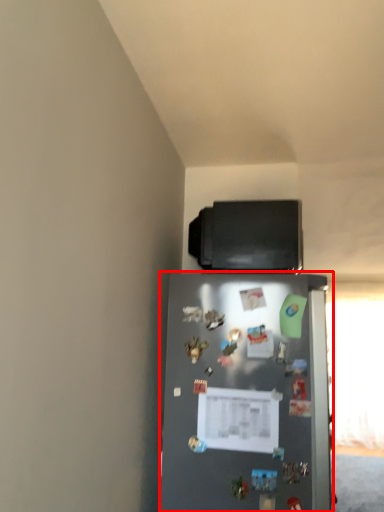
Question: In this image, where is refrigerator (annotated by the red box) located relative to appliance?

Choices:
 (A) right
 (B) left

Answer: (B)